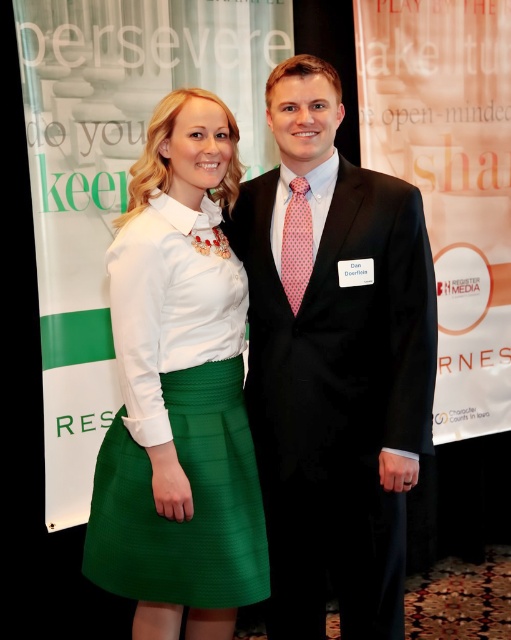
You are organizing a photo shoot and need to ensure that the matte black suit at center and the green textured skirt at center fit within a 1.5 meter wide frame. Based on their sizes, will both items fit side by side without overlapping?

The matte black suit at center is wider than the green textured skirt at center. Since the total width of both items combined would exceed the 1.5 meter frame, they cannot fit side by side without overlapping.

You are at a formal event and need to locate Dan Doerlein. According to the image, where is the matte black suit at center in relation to the green textured skirt at center?

The matte black suit at center is to the right of the green textured skirt at center, so Dan Doerlein is positioned to the right of the green textured skirt at center.

You are organizing a photo shoot and need to ensure that the matte black suit at center and the green textured skirt at center are visible in the frame. Given their sizes, which object should you focus on to ensure both are in the frame without cropping?

The matte black suit at center is larger than the green textured skirt at center, so focusing on the matte black suit at center will help ensure both are visible in the frame without cropping.